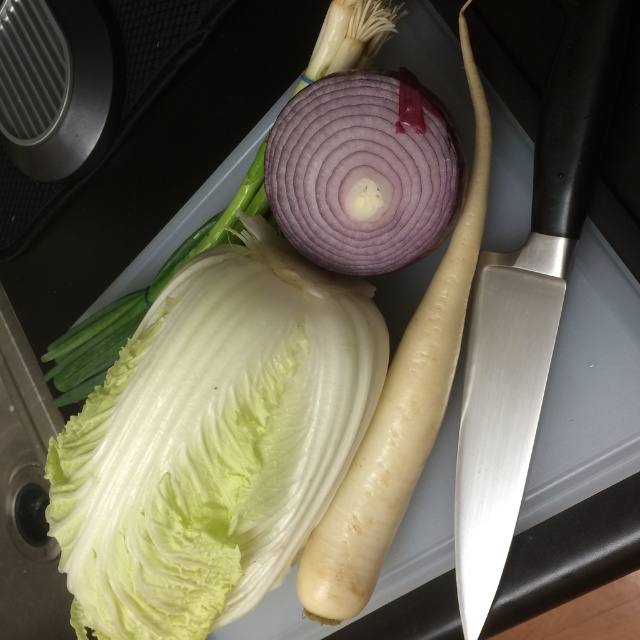
Question: Considering the real-world distances, which object is closest to the purple smooth onion at center?

Choices:
 (A) green leafy cabbage at center
 (B) purple matte onion at center
 (C) satin silver knife at center right

Answer: (C)

Question: Is white crisp lettuce at center thinner than purple matte onion at center?

Choices:
 (A) yes
 (B) no

Answer: (B)

Question: Which object is closer to the camera taking this photo?

Choices:
 (A) satin silver knife at center right
 (B) purple matte onion at center

Answer: (A)

Question: Can you confirm if white crisp lettuce at center is bigger than purple smooth onion at center?

Choices:
 (A) yes
 (B) no

Answer: (A)

Question: Which object is farther from the camera taking this photo?

Choices:
 (A) white crisp lettuce at center
 (B) green leafy cabbage at center
 (C) purple matte onion at center
 (D) purple smooth onion at center

Answer: (B)

Question: Is white crisp lettuce at center to the right of green leafy cabbage at center from the viewer's perspective?

Choices:
 (A) yes
 (B) no

Answer: (A)